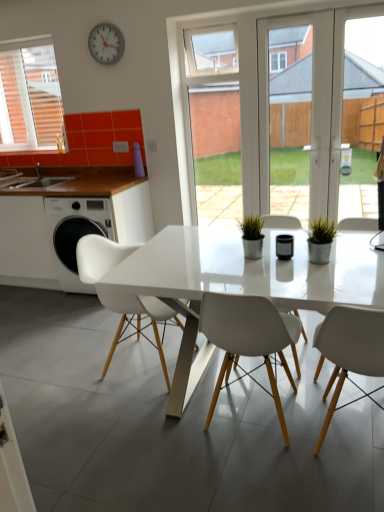
Find the location of `free point above transparent glass door at center (from a real-world perspective)`. free point above transparent glass door at center (from a real-world perspective) is located at coordinates tap(281, 10).